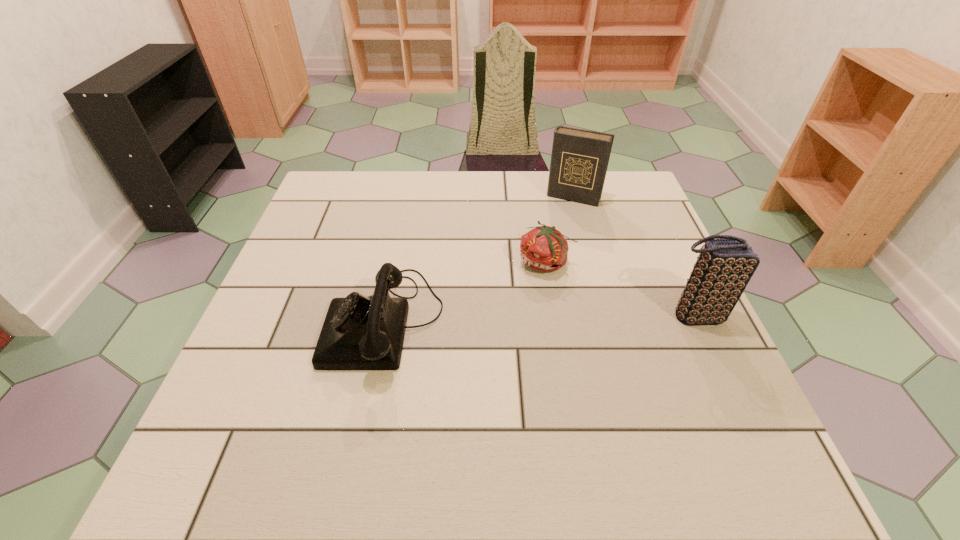
Find the location of a particular element. The height and width of the screenshot is (540, 960). the second shortest object is located at coordinates (359, 333).

I want to click on the leftmost object, so click(359, 333).

This screenshot has width=960, height=540. What are the coordinates of `clutch bag` in the screenshot? It's located at (724, 267).

At what (x,y) coordinates should I click in order to perform the action: click on the farthest object. Please return your answer as a coordinate pair (x, y). Looking at the image, I should click on (579, 160).

At what (x,y) coordinates should I click in order to perform the action: click on tomato. Please return your answer as a coordinate pair (x, y). This screenshot has height=540, width=960. Looking at the image, I should click on (544, 248).

Find the location of a particular element. This screenshot has width=960, height=540. free space located 0.100m on the front face of the telephone is located at coordinates (281, 321).

Find the location of a particular element. This screenshot has height=540, width=960. free spot located 0.100m on the front face of the telephone is located at coordinates (281, 321).

The width and height of the screenshot is (960, 540). What are the coordinates of `vacant space located 0.060m on the front face of the telephone` in the screenshot? It's located at (300, 321).

Locate an element on the screen. The width and height of the screenshot is (960, 540). vacant space located on the front cover of the diary is located at coordinates (547, 249).

The image size is (960, 540). I want to click on free space located 0.150m on the front cover of the diary, so (553, 238).